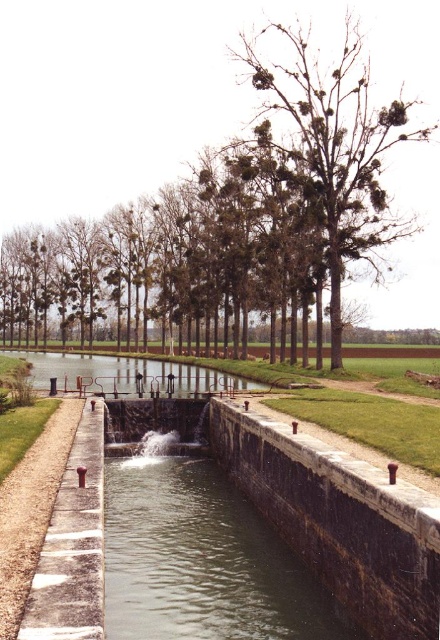
Question: Does clear water at lock center come behind smooth concrete waterway at center?

Choices:
 (A) yes
 (B) no

Answer: (B)

Question: Which object is positioned closest to the brown leafless tree at center?

Choices:
 (A) smooth concrete waterway at center
 (B) clear water at lock center
 (C) concrete sidewalk at lower left

Answer: (A)

Question: Among these objects, which one is farthest from the camera?

Choices:
 (A) concrete sidewalk at lower left
 (B) clear water at lock center

Answer: (B)

Question: Is clear water at lock center behind concrete sidewalk at lower left?

Choices:
 (A) no
 (B) yes

Answer: (B)

Question: Which is nearer to the brown leafless tree at center?

Choices:
 (A) smooth concrete waterway at center
 (B) clear water at lock center

Answer: (A)

Question: Is brown leafless tree at center further to camera compared to concrete sidewalk at lower left?

Choices:
 (A) yes
 (B) no

Answer: (A)